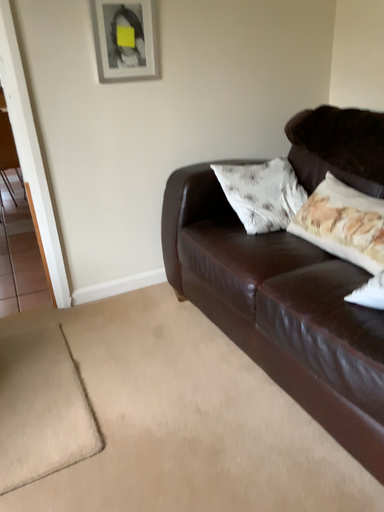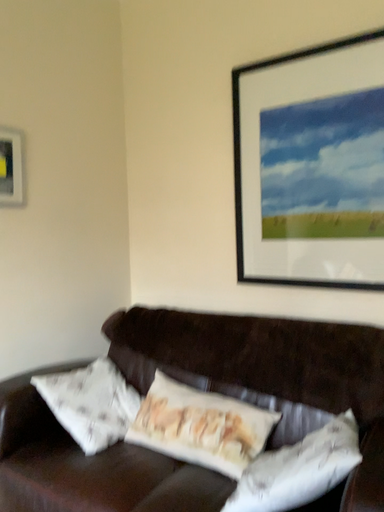
Question: How did the camera likely rotate when shooting the video?

Choices:
 (A) rotated left
 (B) rotated right

Answer: (B)